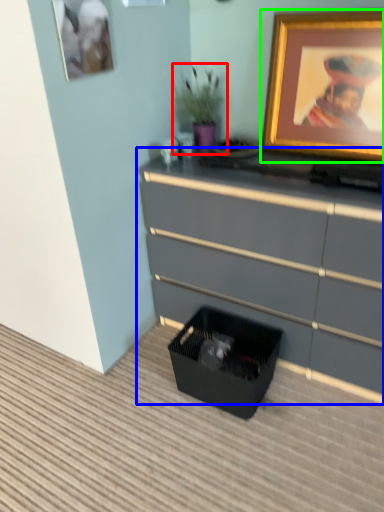
Question: Which is farther away from houseplant (highlighted by a red box)? chest of drawers (highlighted by a blue box) or picture frame (highlighted by a green box)?

Choices:
 (A) chest of drawers
 (B) picture frame

Answer: (A)